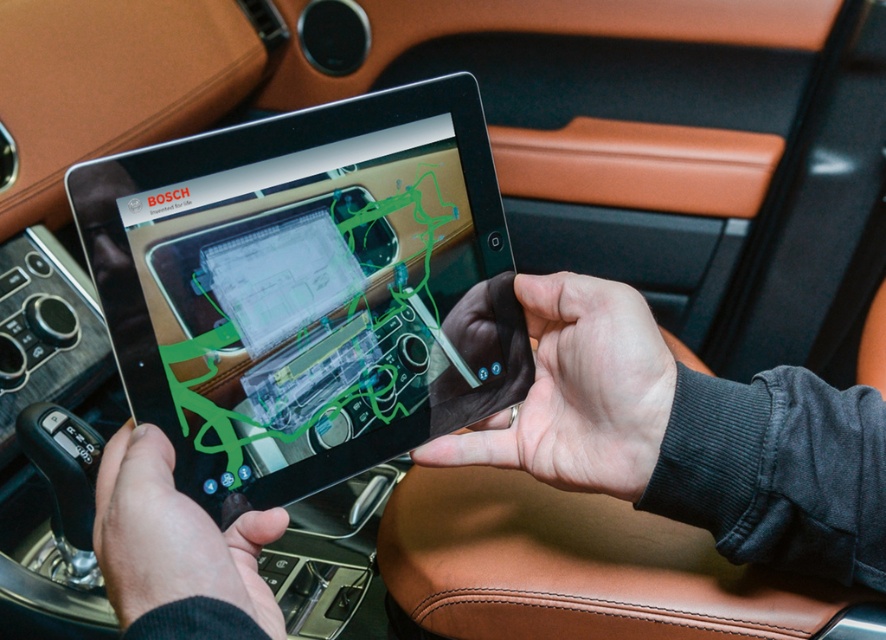
Question: Is smooth leather hand at center wider than black matte hand at lower left?

Choices:
 (A) no
 (B) yes

Answer: (B)

Question: Which of the following is the closest to the observer?

Choices:
 (A) (482, 200)
 (B) (119, 518)

Answer: (B)

Question: Does black glossy tablet at center have a larger size compared to smooth leather hand at center?

Choices:
 (A) no
 (B) yes

Answer: (B)

Question: Is smooth leather hand at center smaller than black matte hand at lower left?

Choices:
 (A) yes
 (B) no

Answer: (B)

Question: Estimate the real-world distances between objects in this image. Which object is closer to the smooth leather hand at center?

Choices:
 (A) black glossy tablet at center
 (B) black matte hand at lower left

Answer: (A)

Question: Which object is farther from the camera taking this photo?

Choices:
 (A) smooth leather hand at center
 (B) black glossy tablet at center

Answer: (A)